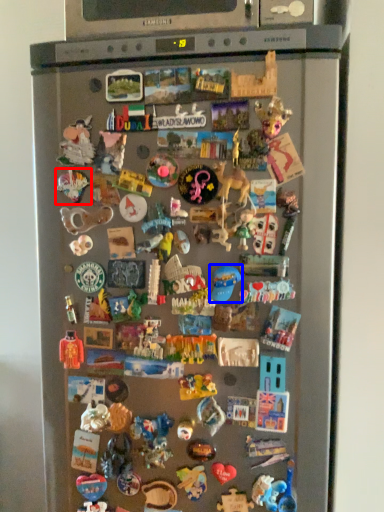
Question: Which of the following is the farthest to the observer, toy (highlighted by a red box) or toy (highlighted by a blue box)?

Choices:
 (A) toy
 (B) toy

Answer: (A)